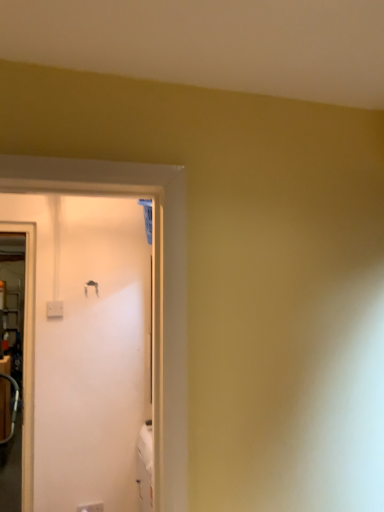
Question: From a real-world perspective, is white plastic electric outlet at lower left physically located above or below metallic silver door handle at upper left?

Choices:
 (A) above
 (B) below

Answer: (B)

Question: From the image's perspective, is white plastic electric outlet at lower left positioned above or below metallic silver door handle at upper left?

Choices:
 (A) above
 (B) below

Answer: (B)

Question: Considering the positions of point (82, 503) and point (89, 281), is point (82, 503) closer or farther from the camera than point (89, 281)?

Choices:
 (A) farther
 (B) closer

Answer: (B)

Question: Is metallic silver door handle at upper left to the left or to the right of white plastic electric outlet at lower left in the image?

Choices:
 (A) right
 (B) left

Answer: (B)

Question: Looking at the image, does metallic silver door handle at upper left seem bigger or smaller compared to white plastic electric outlet at lower left?

Choices:
 (A) small
 (B) big

Answer: (A)

Question: Is point (94, 287) positioned closer to the camera than point (84, 504)?

Choices:
 (A) farther
 (B) closer

Answer: (A)

Question: Is metallic silver door handle at upper left wider or thinner than white plastic electric outlet at lower left?

Choices:
 (A) wide
 (B) thin

Answer: (B)